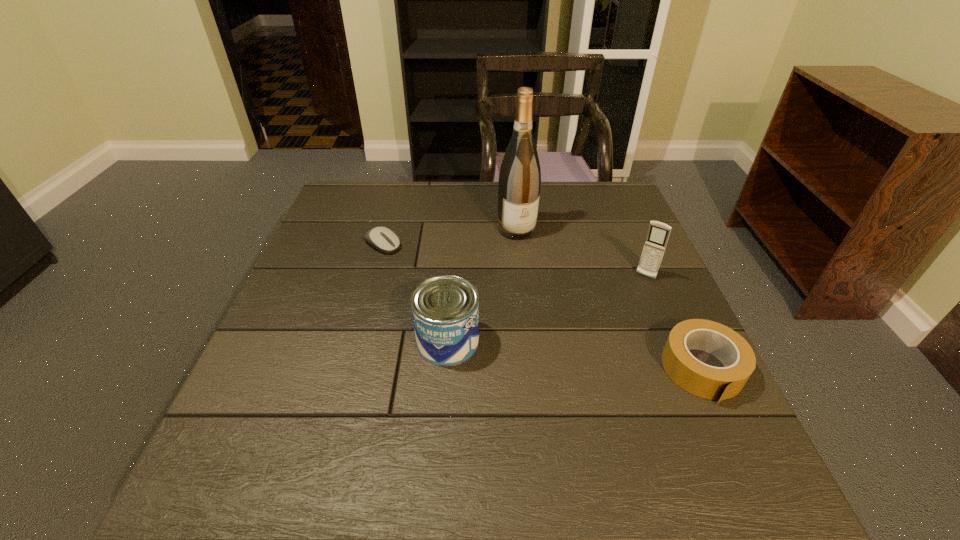
The image size is (960, 540). What are the coordinates of `blank area in the image that satisfies the following two spatial constraints: 1. on the back side of the leftmost object; 2. on the right side of the third object from left to right` in the screenshot? It's located at (387, 230).